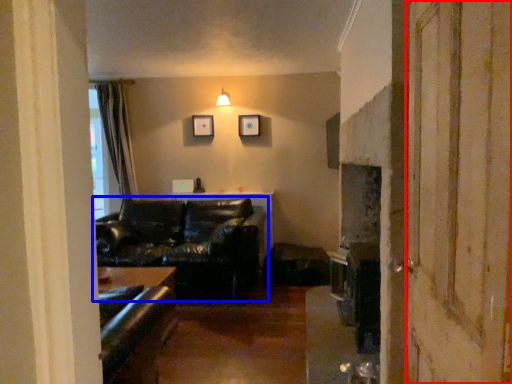
Question: Among these objects, which one is nearest to the camera, screen door (highlighted by a red box) or studio couch (highlighted by a blue box)?

Choices:
 (A) screen door
 (B) studio couch

Answer: (A)